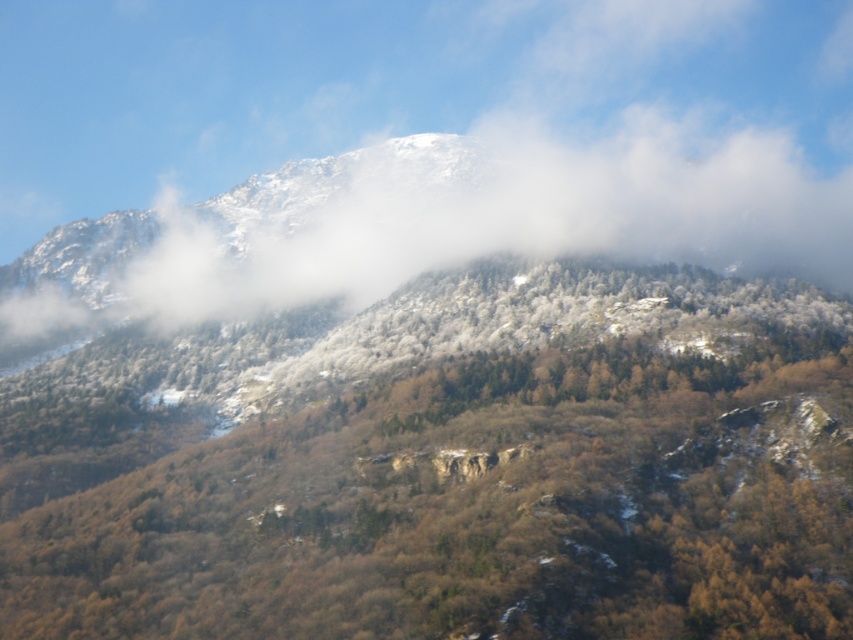
You are standing at the base of the mountain and looking towards the center of the image. There is a point marked at coordinates point (445, 467). What object is located at that point?

The point (445, 467) corresponds to the green matte tree at center.

You are an explorer standing at the base of the mountain. You see the green matte tree at center and the white fluffy cloud at upper center. Which object is positioned more to the right side of your view?

The green matte tree at center is positioned more to the right side of your view compared to the white fluffy cloud at upper center.

You are an environmental scientist analyzing the mountain ecosystem. You observe the green matte tree at center and the white fluffy cloud at upper center. Which object occupies a larger area in the image?

The white fluffy cloud at upper center is larger in size compared to the green matte tree at center, as stated in the description that the green matte tree at center has a smaller size compared to the white fluffy cloud at upper center.